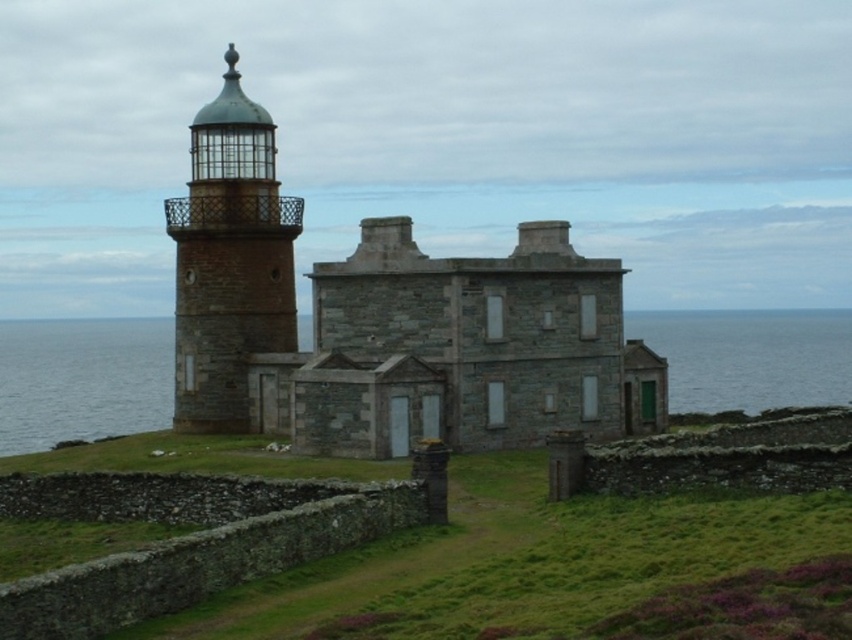
Question: Is the position of stone building at left more distant than that of rustic stone lighthouse at left?

Choices:
 (A) yes
 (B) no

Answer: (B)

Question: Is stone building at left wider than gray stone water at center?

Choices:
 (A) yes
 (B) no

Answer: (B)

Question: Among these objects, which one is nearest to the camera?

Choices:
 (A) green grassy at center
 (B) gray stone water at center
 (C) rustic stone lighthouse at left

Answer: (A)

Question: Based on their relative distances, which object is farther from the stone building at left?

Choices:
 (A) green grassy at center
 (B) rustic stone lighthouse at left

Answer: (A)

Question: Can you confirm if green grassy at center is bigger than stone building at left?

Choices:
 (A) yes
 (B) no

Answer: (B)

Question: Which point is farther to the camera?

Choices:
 (A) (205, 269)
 (B) (394, 547)
 (C) (613, 412)
 (D) (688, 323)

Answer: (D)